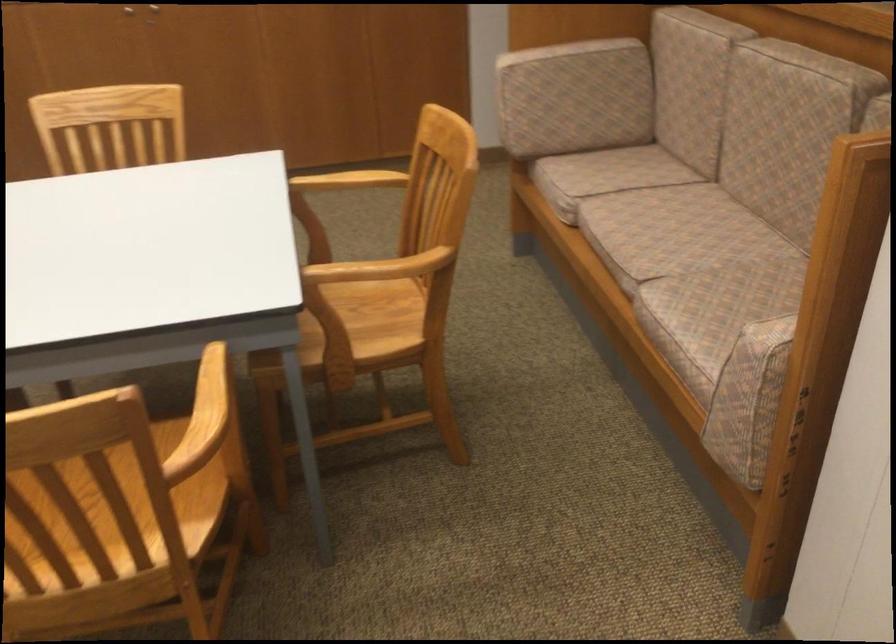
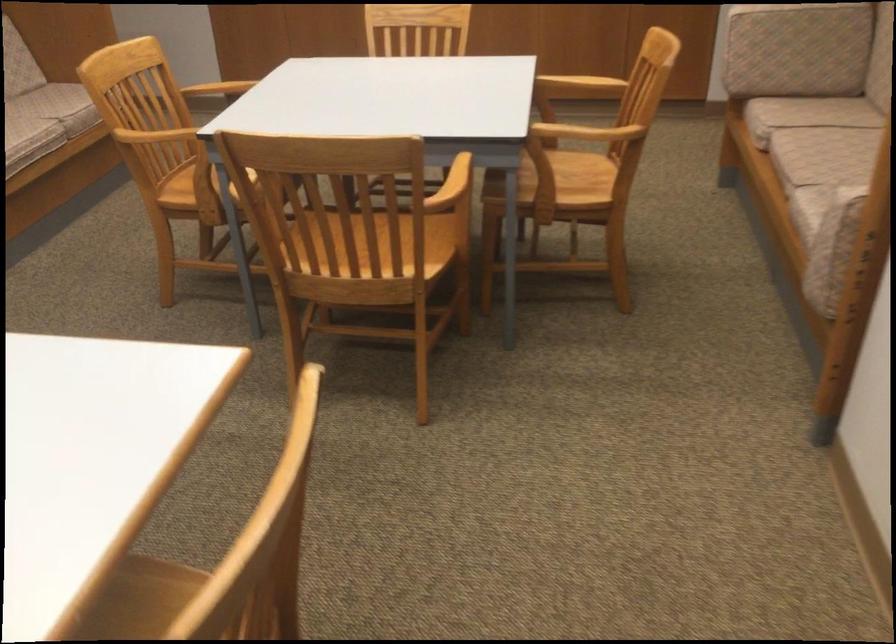
In the second image, find the point that corresponds to (613,180) in the first image.

(807, 114)